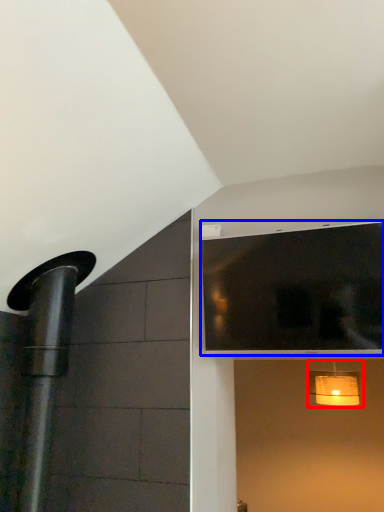
Question: Among these objects, which one is nearest to the camera, light fixture (highlighted by a red box) or window (highlighted by a blue box)?

Choices:
 (A) light fixture
 (B) window

Answer: (B)